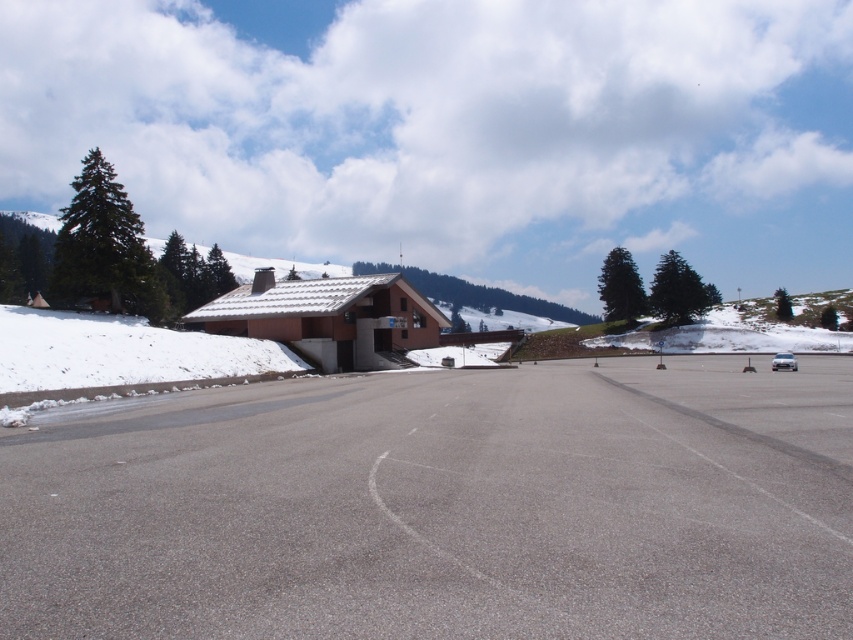
Who is shorter, white snow at left or green matte pine at left?

white snow at left

Which is more to the right, white snow at left or green matte pine at left?

white snow at left

Between point (270, 362) and point (107, 230), which one is positioned behind?

The point (107, 230) is behind.

Where is `white snow at left`? white snow at left is located at coordinates (120, 352).